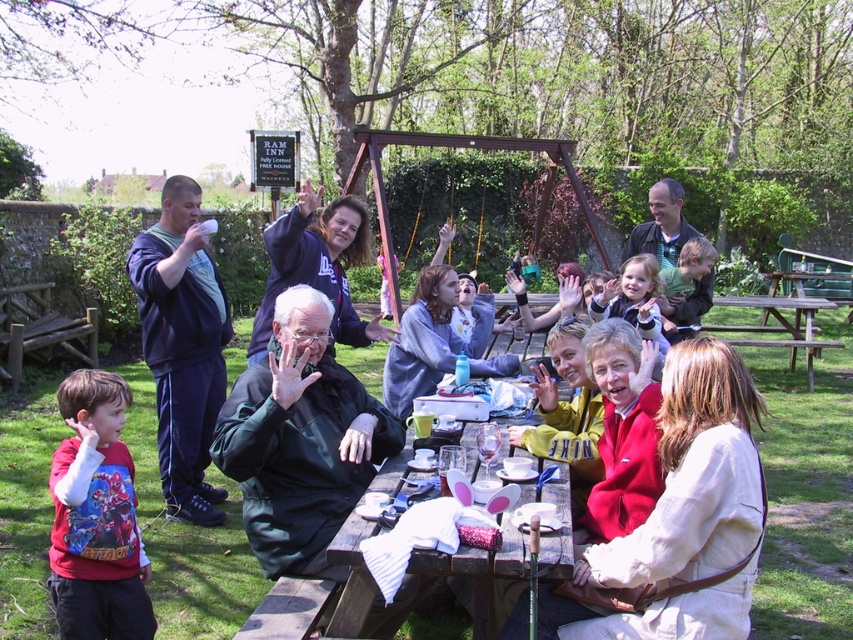
Which is more to the right, green matte jacket at center or brown wooden picnic table at center?

Positioned to the right is brown wooden picnic table at center.

Is point (305, 337) positioned after point (766, 339)?

That is False.

The height and width of the screenshot is (640, 853). I want to click on green matte jacket at center, so click(x=299, y=436).

Which is below, green matte jacket at center or matte green jacket at center?

Positioned lower is matte green jacket at center.

From the picture: Can you confirm if green matte jacket at center is wider than matte green jacket at center?

No, green matte jacket at center is not wider than matte green jacket at center.

Does point (247, 435) come behind point (270, 378)?

No, it is not.

Identify the location of green matte jacket at center. (299, 436).

Does green matte jacket at center appear under wooden picnic table at center?

Actually, green matte jacket at center is above wooden picnic table at center.

What do you see at coordinates (299, 436) in the screenshot? This screenshot has height=640, width=853. I see `green matte jacket at center` at bounding box center [299, 436].

The height and width of the screenshot is (640, 853). What do you see at coordinates (299, 436) in the screenshot?
I see `green matte jacket at center` at bounding box center [299, 436].

At what (x,y) coordinates should I click in order to perform the action: click on green matte jacket at center. Please return your answer as a coordinate pair (x, y). This screenshot has width=853, height=640. Looking at the image, I should click on (299, 436).